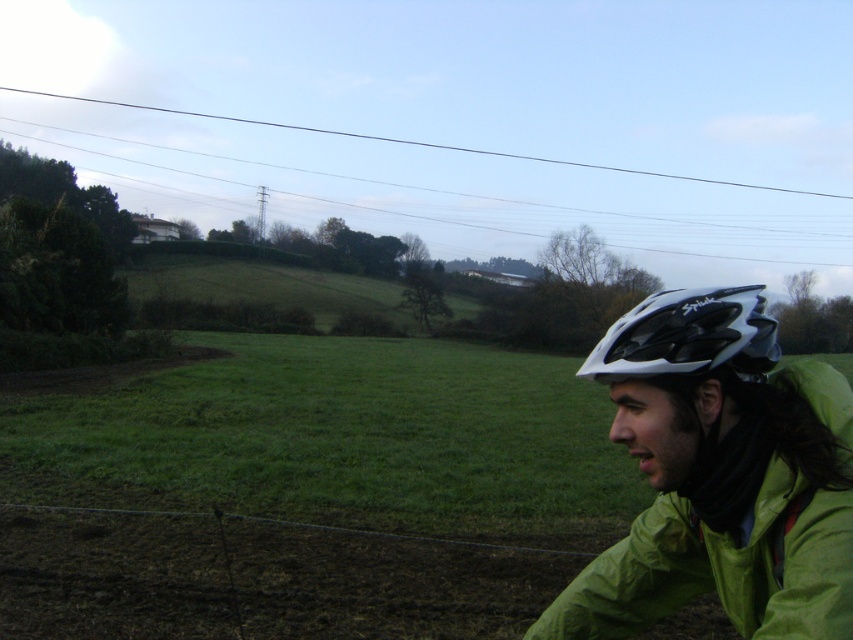
Looking at this image, you are a photographer trying to capture a photo of the green matte jacket at lower right and the white matte bicycle helmet at right. You want to ensure both are visible in the frame. Based on their positions, which object should you focus on first to include both in the shot?

The green matte jacket at lower right is positioned on the left side of the white matte bicycle helmet at right. To include both in the shot, focus on the white matte bicycle helmet at right first since it is further to the right and ensure the green matte jacket at lower right is also within the frame.

You are an observer standing in front of the scene. You notice the green matte jacket at lower right and the white matte bicycle helmet at right. Which object is smaller in size?

The green matte jacket at lower right has a smaller size compared to the white matte bicycle helmet at right.